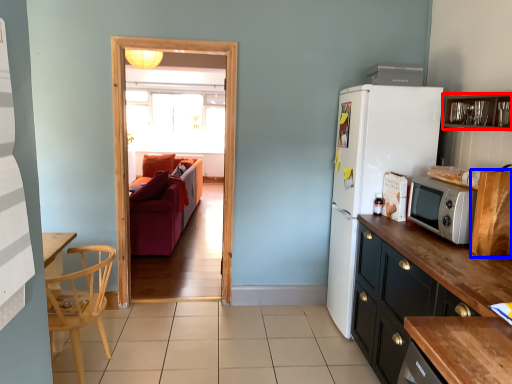
Question: Which object appears farthest to the camera in this image, cabinetry (highlighted by a red box) or cabinetry (highlighted by a blue box)?

Choices:
 (A) cabinetry
 (B) cabinetry

Answer: (B)